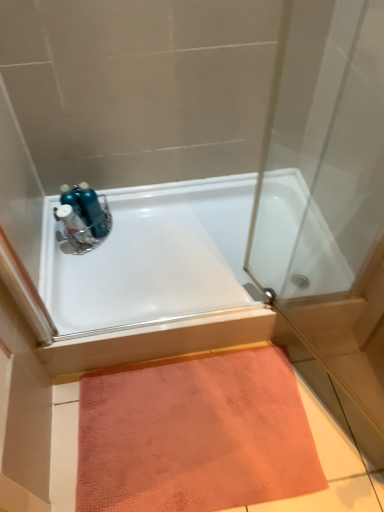
The image size is (384, 512). What are the coordinates of `unoccupied region to the right of metallic blue sink at upper left` in the screenshot? It's located at (127, 245).